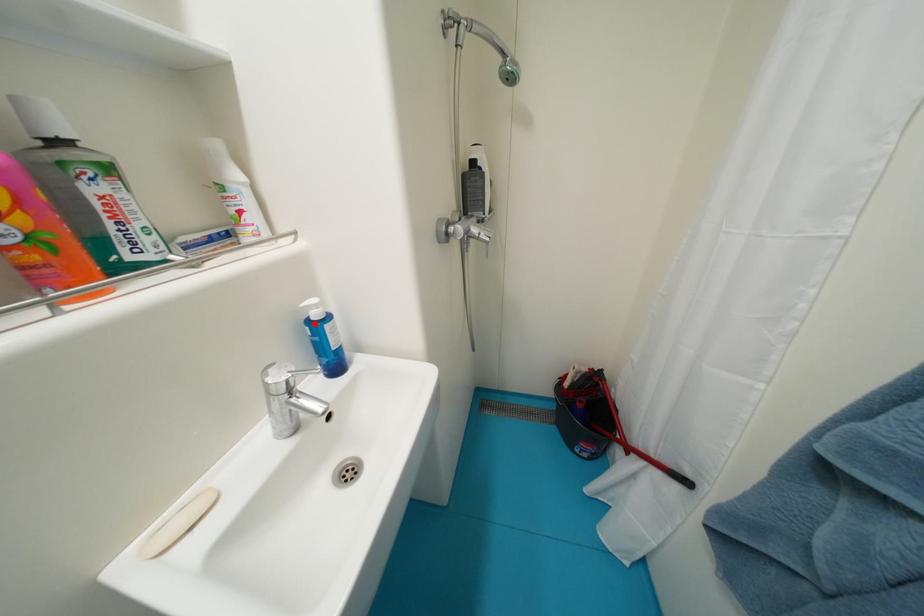
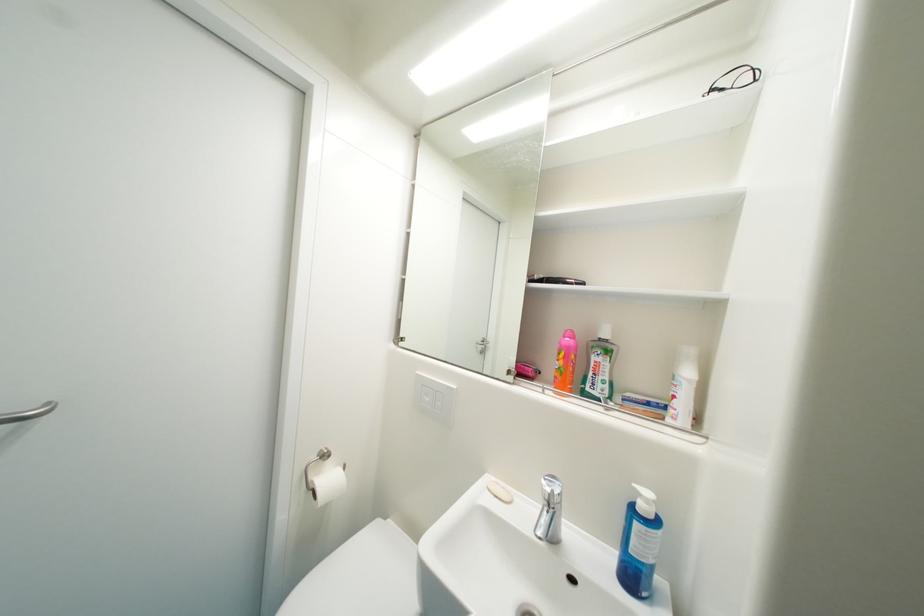
In the second image, find the point that corresponds to the highlighted location in the first image.

(641, 507)